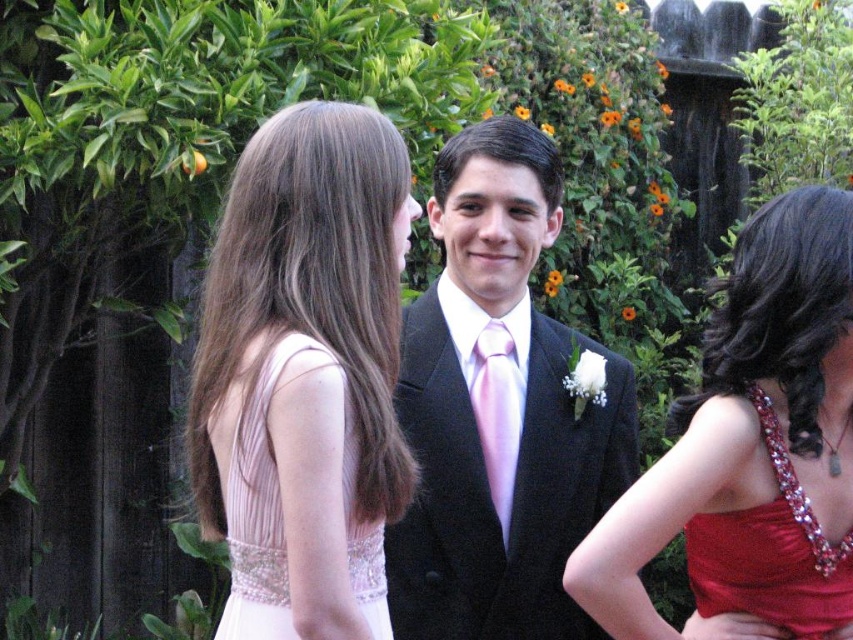
Question: Which point is farther to the camera?

Choices:
 (A) matte black suit at center
 (B) shiny red dress at center

Answer: (A)

Question: Does shiny red dress at center appear on the right side of pink satin tie at center?

Choices:
 (A) no
 (B) yes

Answer: (B)

Question: Considering the real-world distances, which object is closest to the pink satin dress at upper left?

Choices:
 (A) pink satin tie at center
 (B) pink satin dress at left
 (C) matte black suit at center

Answer: (B)

Question: Can you confirm if shiny red dress at right is positioned to the right of pink satin dress at left?

Choices:
 (A) no
 (B) yes

Answer: (B)

Question: Which of the following is the farthest from the observer?

Choices:
 (A) (335, 570)
 (B) (505, 531)
 (C) (840, 605)
 (D) (569, 456)

Answer: (D)

Question: Is pink satin dress at upper left above shiny red dress at center?

Choices:
 (A) no
 (B) yes

Answer: (B)